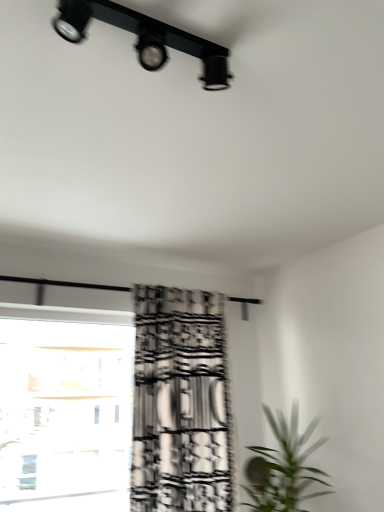
Where is `black printed fabric curtain at center`? The height and width of the screenshot is (512, 384). black printed fabric curtain at center is located at coordinates (180, 403).

This screenshot has height=512, width=384. I want to click on green leafy plant at lower right, so click(283, 467).

In order to click on black matte track light at upper center in this screenshot , I will do `click(145, 37)`.

Is black printed fabric curtain at center positioned with its back to green leafy plant at lower right?

No, black printed fabric curtain at center is not facing away from green leafy plant at lower right.

From the picture: From the image's perspective, between black printed fabric curtain at center and green leafy plant at lower right, which one is located above?

From the image's view, black printed fabric curtain at center is above.

You are a GUI agent. You are given a task and a screenshot of the screen. Output one action in this format:
    pyautogui.click(x=<x>, y=<y>)
    Task: Click on the houseplant below the black printed fabric curtain at center (from the image's perspective)
    
    Given the screenshot: What is the action you would take?
    pyautogui.click(x=283, y=467)

Is black printed fabric curtain at center smaller than green leafy plant at lower right?

Actually, black printed fabric curtain at center might be larger than green leafy plant at lower right.

Is black matte track light at upper center wider than black printed fabric curtain at center?

Incorrect, the width of black matte track light at upper center does not surpass that of black printed fabric curtain at center.

Is black matte track light at upper center aimed at black printed fabric curtain at center?

No, black matte track light at upper center is not turned towards black printed fabric curtain at center.

Is black matte track light at upper center in front of or behind black printed fabric curtain at center in the image?

black matte track light at upper center is positioned closer to the viewer than black printed fabric curtain at center.

How different are the orientations of black matte track light at upper center and black printed fabric curtain at center in degrees?

1.4e-05 degrees.

In the scene shown: Is transparent glass window at lower left inside green leafy plant at lower right?

No, transparent glass window at lower left is not inside green leafy plant at lower right.

From a real-world perspective, is green leafy plant at lower right under transparent glass window at lower left?

Yes.

Which point is more forward, (249, 486) or (82, 451)?

Positioned in front is point (249, 486).

How different are the orientations of green leafy plant at lower right and transparent glass window at lower left in degrees?

The angular difference between green leafy plant at lower right and transparent glass window at lower left is 88.8 degrees.

Based on the photo, between green leafy plant at lower right and black matte track light at upper center, which one appears on the left side from the viewer's perspective?

Positioned to the left is black matte track light at upper center.

Are green leafy plant at lower right and black matte track light at upper center located far from each other?

Indeed, green leafy plant at lower right is not near black matte track light at upper center.

Which is in front, green leafy plant at lower right or black matte track light at upper center?

black matte track light at upper center is closer to the camera.

Is green leafy plant at lower right positioned beyond the bounds of black matte track light at upper center?

green leafy plant at lower right lies outside black matte track light at upper center's area.

Considering the points (200, 40) and (98, 454), which point is behind, point (200, 40) or point (98, 454)?

The point (98, 454) is more distant.

Is black matte track light at upper center inside or outside of transparent glass window at lower left?

black matte track light at upper center is not enclosed by transparent glass window at lower left.

Looking at this image, between black matte track light at upper center and transparent glass window at lower left, which one has larger width?

black matte track light at upper center is wider.

Where is `window below the black matte track light at upper center (from a real-world perspective)`? window below the black matte track light at upper center (from a real-world perspective) is located at coordinates (65, 414).

Can you confirm if transparent glass window at lower left is bigger than black matte track light at upper center?

Indeed, transparent glass window at lower left has a larger size compared to black matte track light at upper center.

Is black matte track light at upper center completely or partially inside transparent glass window at lower left?

That's incorrect, black matte track light at upper center is not inside transparent glass window at lower left.

From the image's perspective, is transparent glass window at lower left on black matte track light at upper center?

No, from the image's perspective, transparent glass window at lower left is not over black matte track light at upper center.

Is transparent glass window at lower left beside green leafy plant at lower right?

They are not placed beside each other.

From a real-world perspective, relative to green leafy plant at lower right, is transparent glass window at lower left vertically above or below?

Clearly, from a real-world perspective, transparent glass window at lower left is above green leafy plant at lower right.

In the image, there is a green leafy plant at lower right. Identify the location of window above it (from the image's perspective). (65, 414).

Measure the distance from transparent glass window at lower left to green leafy plant at lower right.

They are 3.48 feet apart.

Image resolution: width=384 pixels, height=512 pixels. What are the coordinates of `curtain that appears on the left of green leafy plant at lower right` in the screenshot? It's located at (180, 403).

The width and height of the screenshot is (384, 512). I want to click on curtain that is below the black matte track light at upper center (from the image's perspective), so click(180, 403).

Based on the photo, estimate the real-world distances between objects in this image. Which object is closer to black matte track light at upper center, black printed fabric curtain at center or green leafy plant at lower right?

black printed fabric curtain at center is closer to black matte track light at upper center.

Considering their positions, is transparent glass window at lower left positioned closer to black printed fabric curtain at center than green leafy plant at lower right?

green leafy plant at lower right.

Considering their positions, is black matte track light at upper center positioned closer to transparent glass window at lower left than green leafy plant at lower right?

green leafy plant at lower right.

Consider the image. When comparing their distances from green leafy plant at lower right, does black matte track light at upper center or transparent glass window at lower left seem closer?

transparent glass window at lower left is closer to green leafy plant at lower right.

Considering their positions, is green leafy plant at lower right positioned closer to black matte track light at upper center than transparent glass window at lower left?

green leafy plant at lower right lies closer to black matte track light at upper center than the other object.

Considering their positions, is green leafy plant at lower right positioned closer to black printed fabric curtain at center than transparent glass window at lower left?

Among the two, green leafy plant at lower right is located nearer to black printed fabric curtain at center.

Based on their spatial positions, is transparent glass window at lower left or green leafy plant at lower right further from black matte track light at upper center?

transparent glass window at lower left.

Looking at the image, which one is located closer to green leafy plant at lower right, black matte track light at upper center or black printed fabric curtain at center?

The object closer to green leafy plant at lower right is black printed fabric curtain at center.

At what (x,y) coordinates should I click in order to perform the action: click on curtain between black matte track light at upper center and green leafy plant at lower right from top to bottom. Please return your answer as a coordinate pair (x, y). This screenshot has width=384, height=512. Looking at the image, I should click on (180, 403).

At what (x,y) coordinates should I click in order to perform the action: click on curtain between black matte track light at upper center and transparent glass window at lower left vertically. Please return your answer as a coordinate pair (x, y). The height and width of the screenshot is (512, 384). Looking at the image, I should click on (180, 403).

This screenshot has width=384, height=512. I want to click on curtain situated between transparent glass window at lower left and green leafy plant at lower right from left to right, so click(x=180, y=403).

Locate an element on the screen. The width and height of the screenshot is (384, 512). window between black matte track light at upper center and green leafy plant at lower right in the vertical direction is located at coordinates (65, 414).